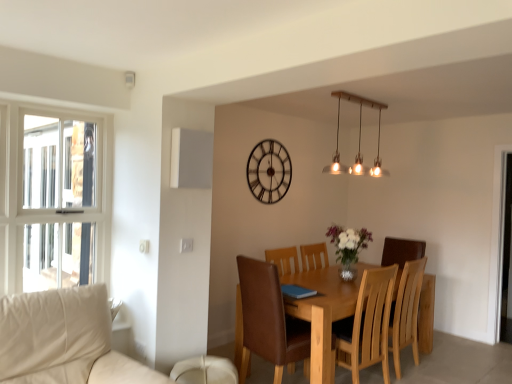
In order to click on vacant area located to the right-hand side of light brown wood chair at center, the 1th chair when ordered from right to left in this screenshot , I will do `click(436, 369)`.